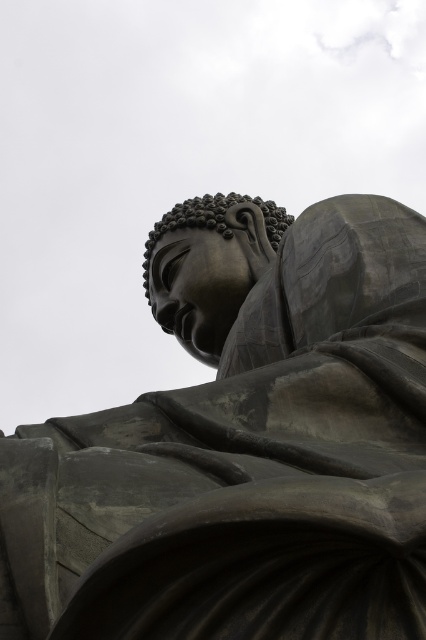
You are a photographer standing in front of the bronze statue at center and the matte bronze head at center. You want to capture a photo where both objects are visible. Which object should you focus on first to ensure it appears sharp in the foreground?

The matte bronze head at center is above the bronze statue at center, so focusing on the matte bronze head at center first will ensure it appears sharp in the foreground.

You are an art conservator examining the Buddha statue. You notice two parts of the statue labeled as the bronze statue at center and the matte bronze head at center. Which part is larger in size?

The bronze statue at center is bigger than the matte bronze head at center, so the bronze statue at center is larger in size.

You are a photographer trying to capture the bronze statue at center and the matte bronze head at center in a single frame. Based on their sizes, which one should you focus on to ensure both are visible without cropping?

The bronze statue at center is taller than the matte bronze head at center, so focusing on the bronze statue at center would allow both to be visible without cropping since it occupies more vertical space.